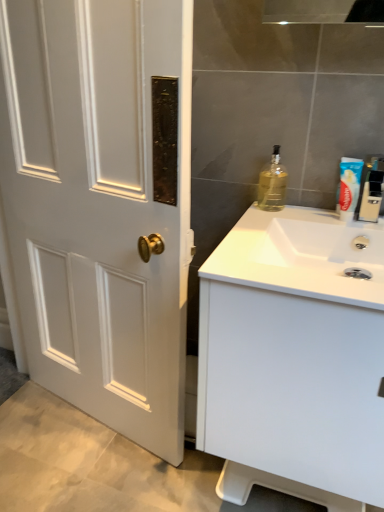
The width and height of the screenshot is (384, 512). Identify the location of free location to the right of translucent glass bottle at upper right, the second bottle in the right-to-left sequence. pos(311,211).